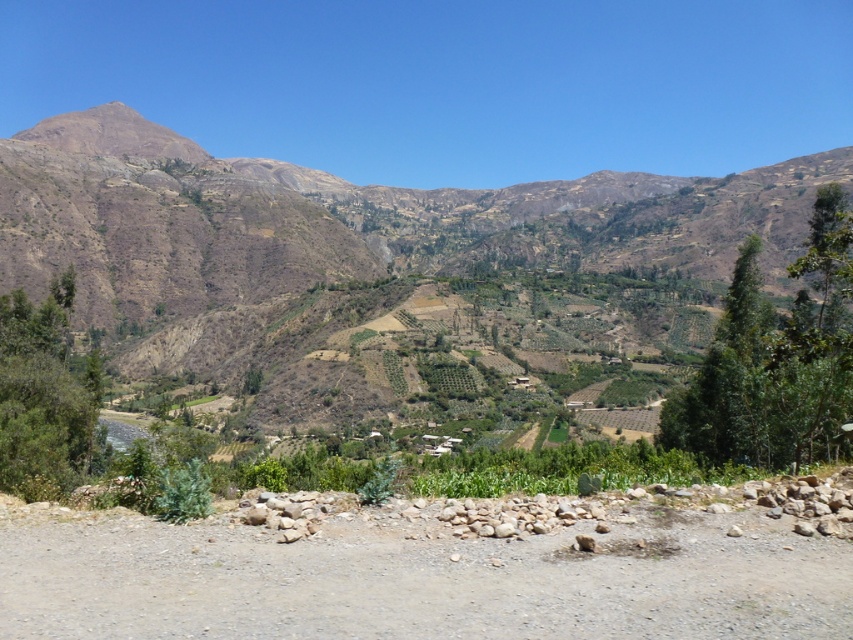
You are a hiker planning to climb the brown dry mountain at upper center. You have a map showing a point at coordinates (426, 280). Is this point likely to be the summit of the brown dry mountain at upper center?

The brown dry mountain at upper center is represented by point (426, 280), so yes, this point is likely the summit of the brown dry mountain at upper center.